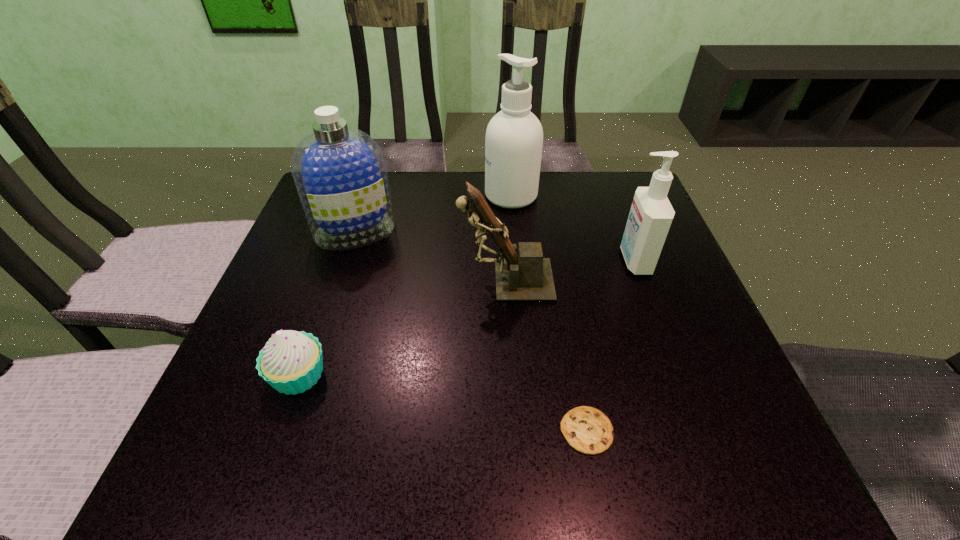
Find the location of `free region at the near left corner`. free region at the near left corner is located at coordinates (236, 452).

Where is `vacant region at the far right corner`? The image size is (960, 540). vacant region at the far right corner is located at coordinates (631, 172).

At what (x,y) coordinates should I click in order to perform the action: click on free point between the shortest object and the figurine. Please return your answer as a coordinate pair (x, y). Looking at the image, I should click on (x=546, y=355).

Identify the location of unoccupied position between the tallest object and the cookie. The width and height of the screenshot is (960, 540). (549, 313).

Find the location of `free spot between the figurine and the leftmost cleansing agent`. free spot between the figurine and the leftmost cleansing agent is located at coordinates (430, 255).

Find the location of `vacant point located between the second shortest object and the leftmost cleansing agent`. vacant point located between the second shortest object and the leftmost cleansing agent is located at coordinates (326, 303).

Locate an element on the screen. The width and height of the screenshot is (960, 540). free space between the cookie and the rightmost object is located at coordinates (611, 346).

You are a GUI agent. You are given a task and a screenshot of the screen. Output one action in this format:
    pyautogui.click(x=<x>, y=<y>)
    Task: Click on the vacant space that is in between the leftmost cleansing agent and the farthest object
    The image size is (960, 540).
    Given the screenshot: What is the action you would take?
    pyautogui.click(x=433, y=213)

You are a GUI agent. You are given a task and a screenshot of the screen. Output one action in this format:
    pyautogui.click(x=<x>, y=<y>)
    Task: Click on the free space between the nearest object and the tallest object
    
    Given the screenshot: What is the action you would take?
    pyautogui.click(x=549, y=313)

At what (x,y) coordinates should I click in order to perform the action: click on vacant area that lies between the shortest object and the figurine. Please return your answer as a coordinate pair (x, y). Looking at the image, I should click on (546, 355).